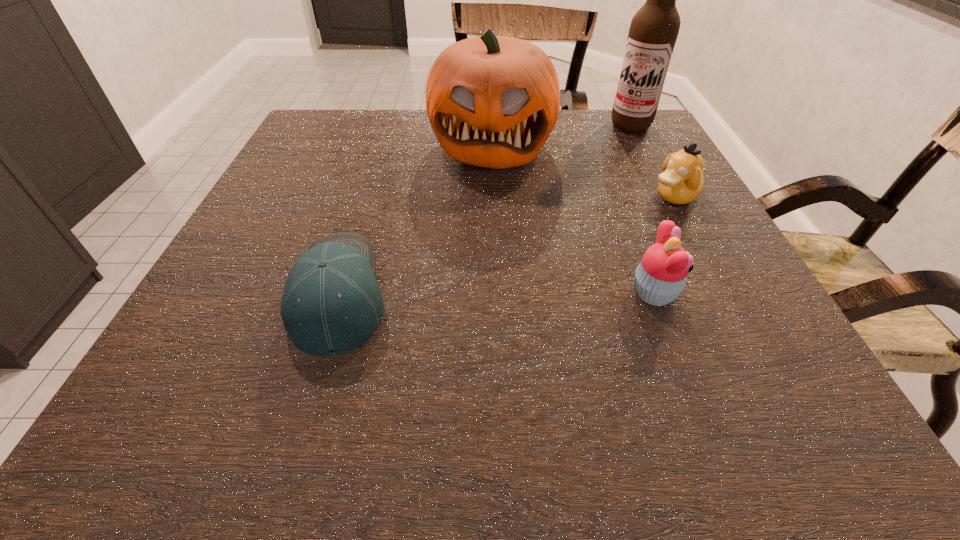
The height and width of the screenshot is (540, 960). I want to click on blank space located on the face of the fourth shortest object, so pyautogui.click(x=484, y=199).

The image size is (960, 540). What are the coordinates of `vacant space located on the label of the alcohol` in the screenshot? It's located at (611, 153).

Find the location of `vacant region located 0.330m on the label of the alcohol`. vacant region located 0.330m on the label of the alcohol is located at coordinates (578, 201).

Find the location of a particular element. free space located on the label of the alcohol is located at coordinates (578, 201).

You are a GUI agent. You are given a task and a screenshot of the screen. Output one action in this format:
    pyautogui.click(x=<x>, y=<y>)
    Task: Click on the vacant space located 0.310m on the face of the third farthest object
    
    Given the screenshot: What is the action you would take?
    pyautogui.click(x=535, y=261)

The height and width of the screenshot is (540, 960). I want to click on vacant area located on the face of the third farthest object, so click(535, 261).

Locate an element on the screen. The width and height of the screenshot is (960, 540). vacant space situated on the face of the third farthest object is located at coordinates (586, 237).

You are a GUI agent. You are given a task and a screenshot of the screen. Output one action in this format:
    pyautogui.click(x=<x>, y=<y>)
    Task: Click on the pumpkin that is at the far edge
    Image resolution: width=960 pixels, height=540 pixels.
    Given the screenshot: What is the action you would take?
    pyautogui.click(x=492, y=101)

Locate an element on the screen. alcohol that is at the far edge is located at coordinates (653, 32).

Locate an element on the screen. baseball cap that is at the near edge is located at coordinates (331, 303).